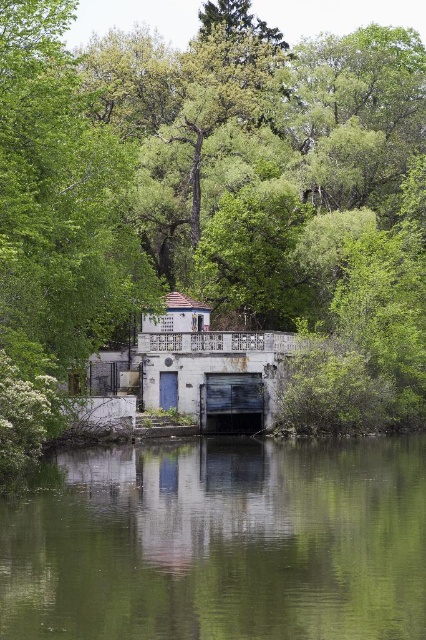
You are standing at the point with coordinates point (350, 461) and want to walk to the point (345, 200). Will you have to go around the boathouse or can you walk directly towards it?

Since point (345, 200) is behind point (350, 461), you will have to go around the boathouse to reach it as it is not directly visible from your current position.